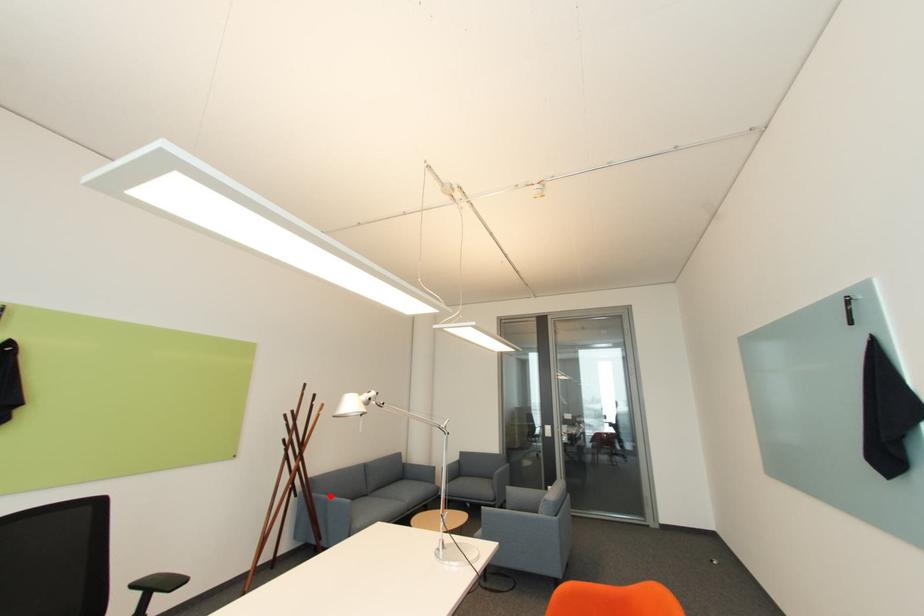
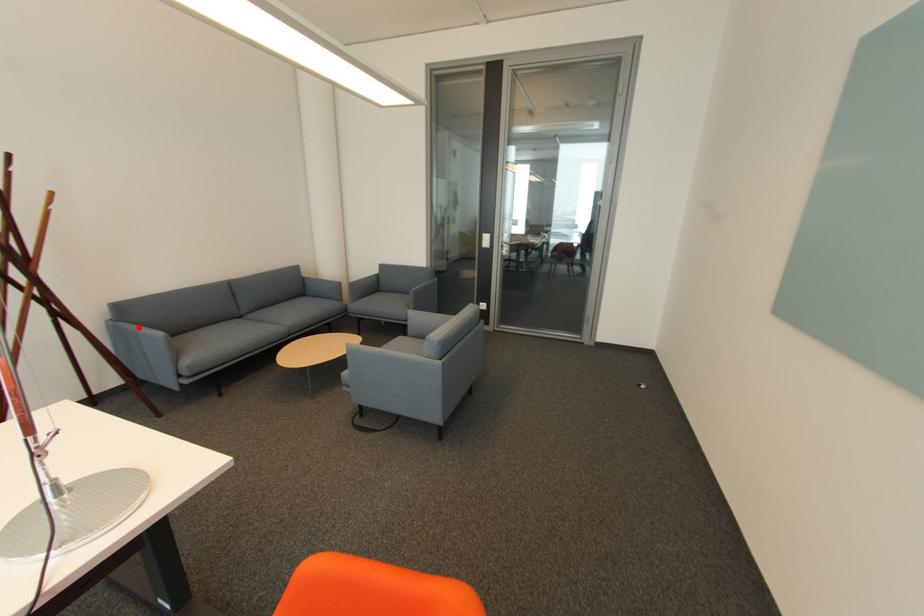
I am providing you with two images of the same scene from different viewpoints. A red point is marked on the first image and another point is marked on the second image. Does the point marked in image1 correspond to the same location as the one in image2?

Yes